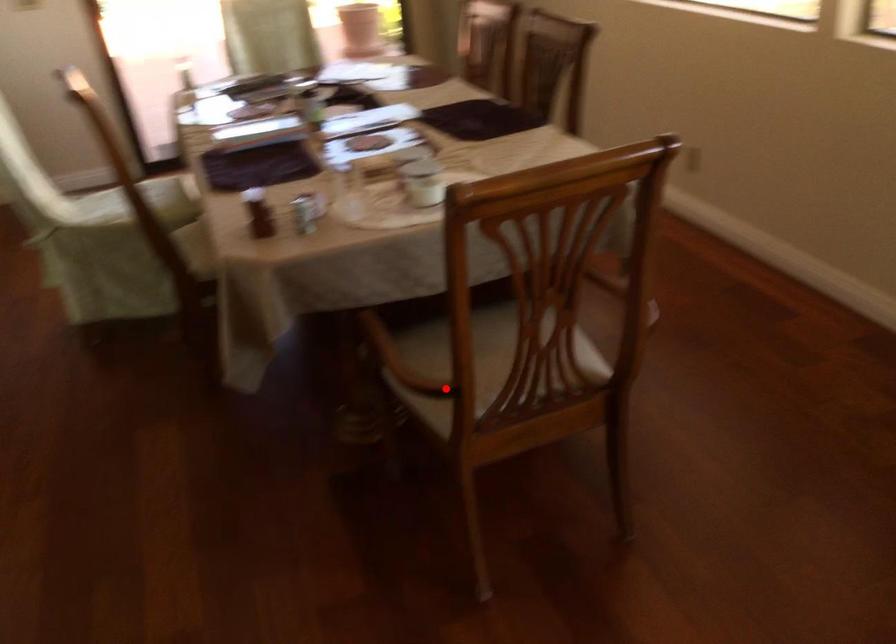
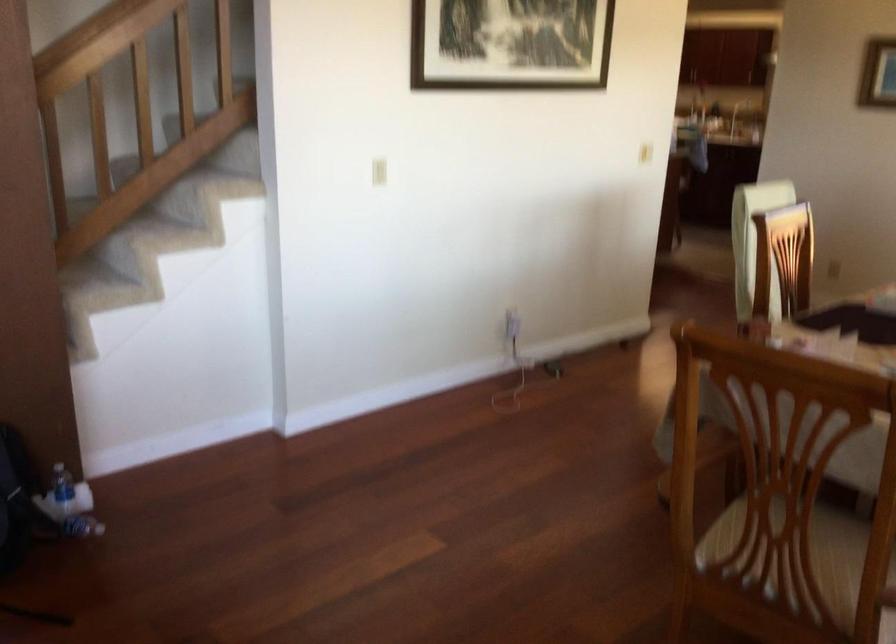
Question: I am providing you with two images of the same scene from different viewpoints. Given a red point in image1, look at the same physical point in image2. Is it:

Choices:
 (A) Closer to the viewpoint
 (B) Farther from the viewpoint

Answer: (B)